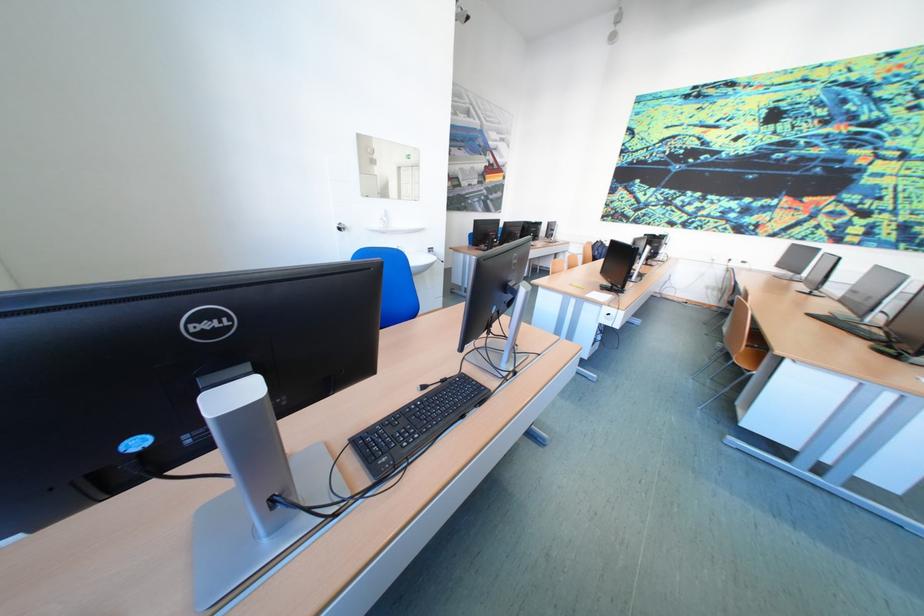
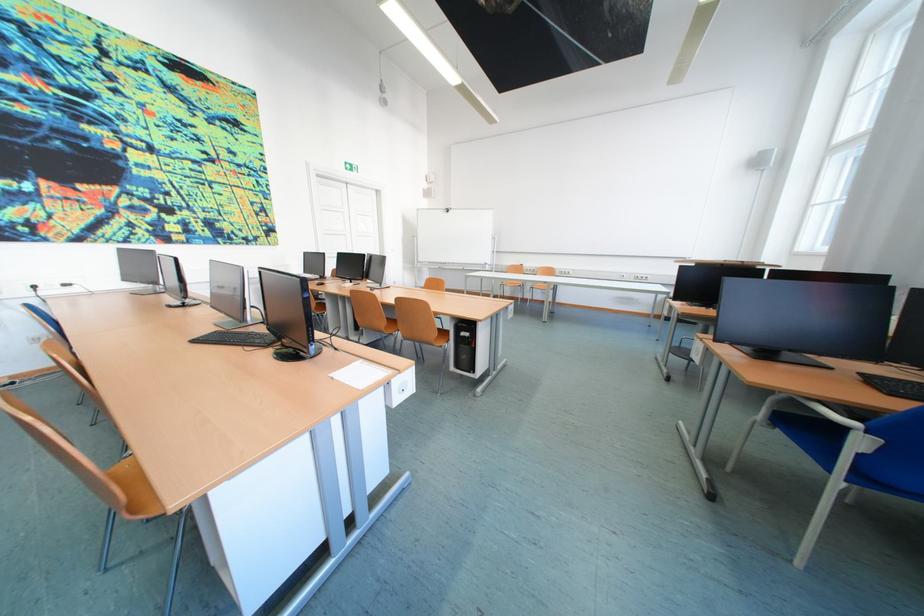
Where in the second image is the point corresponding to (x=821, y=317) from the first image?

(208, 342)